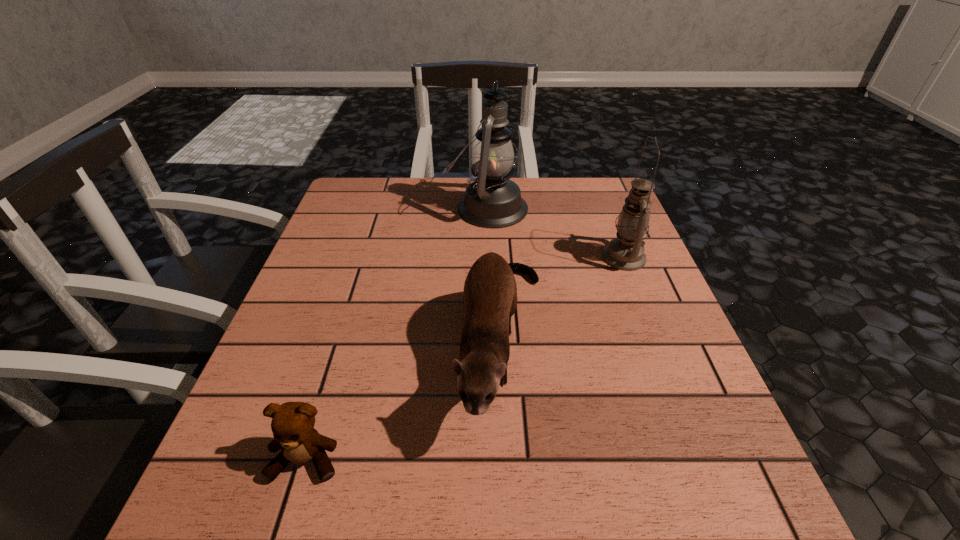
At what (x,y) coordinates should I click in order to perform the action: click on object at the far edge. Please return your answer as a coordinate pair (x, y). Looking at the image, I should click on (491, 200).

The height and width of the screenshot is (540, 960). Identify the location of object situated at the near edge. (292, 424).

The width and height of the screenshot is (960, 540). I want to click on object that is at the left edge, so tap(292, 424).

Find the location of `object positioned at the right edge`. object positioned at the right edge is located at coordinates (625, 252).

This screenshot has height=540, width=960. I want to click on object at the near left corner, so click(x=292, y=424).

Image resolution: width=960 pixels, height=540 pixels. In the image, there is a desktop. What are the coordinates of `vacant space at the far edge` in the screenshot? It's located at (444, 213).

Where is `free space at the near edge of the desktop`? free space at the near edge of the desktop is located at coordinates (599, 484).

Find the location of a particular element. vacant space at the left edge is located at coordinates (252, 478).

The height and width of the screenshot is (540, 960). In the image, there is a desktop. Identify the location of vacant region at the right edge. (596, 269).

The height and width of the screenshot is (540, 960). I want to click on vacant area at the far left corner of the desktop, so click(386, 193).